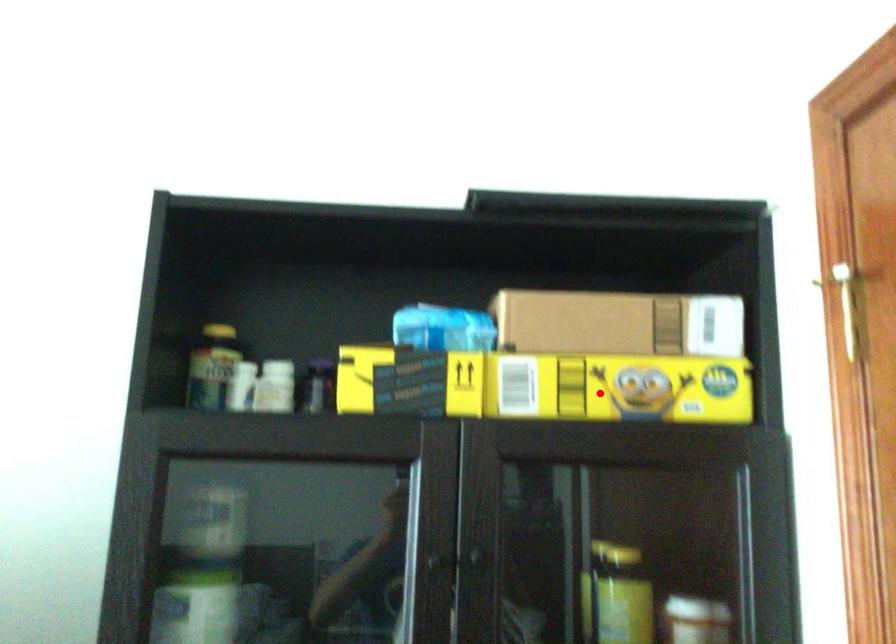
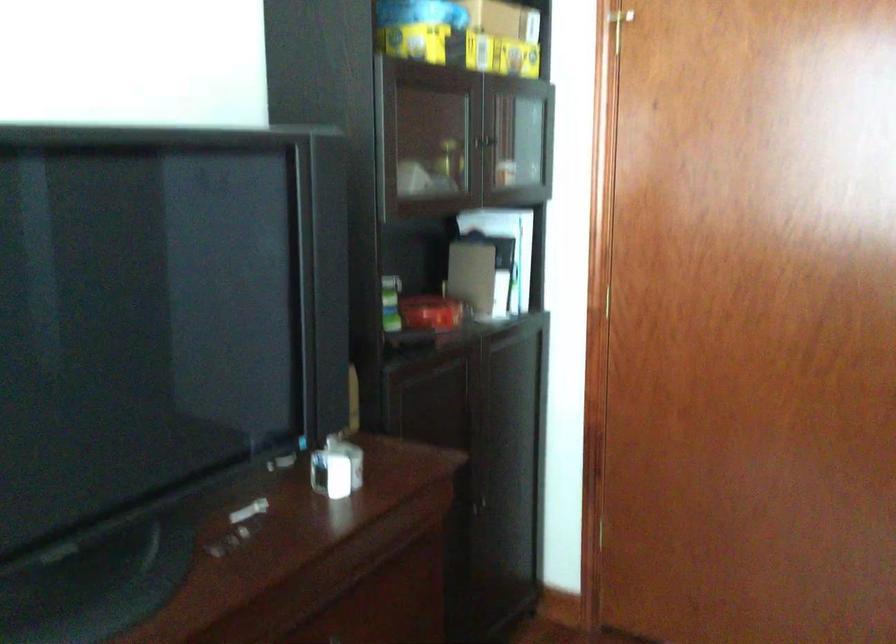
Where in the second image is the point corresponding to the highlighted location from the first image?

(502, 55)